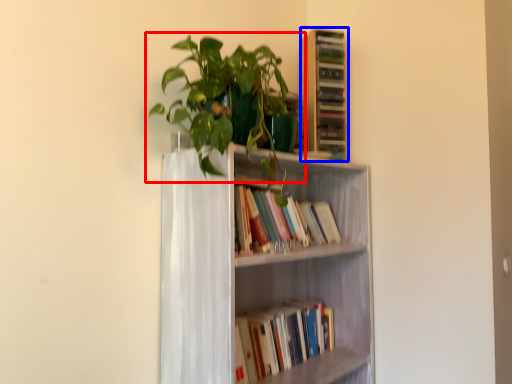
Question: Which of the following is the farthest to the observer, houseplant (highlighted by a red box) or shelf (highlighted by a blue box)?

Choices:
 (A) houseplant
 (B) shelf

Answer: (B)